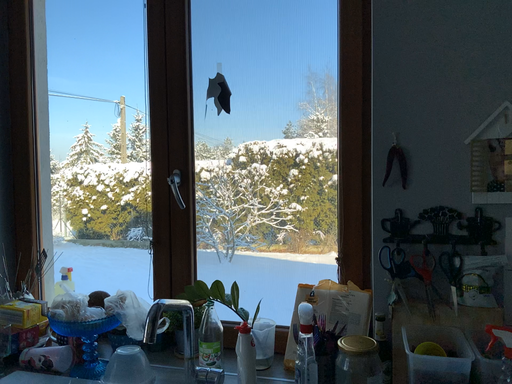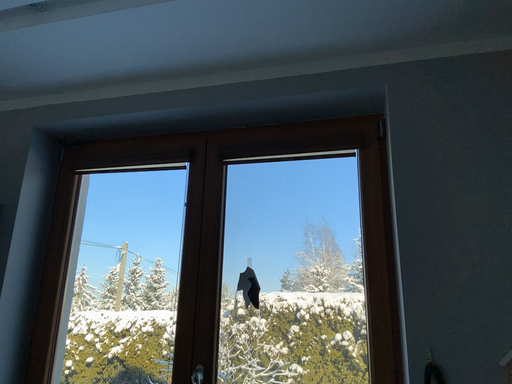
Question: Which way did the camera rotate in the video?

Choices:
 (A) rotated downward
 (B) rotated upward

Answer: (B)